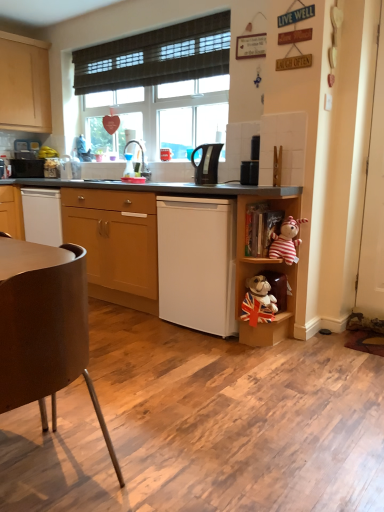
Image resolution: width=384 pixels, height=512 pixels. I want to click on free space behind brown matte chair at lower left, so click(104, 389).